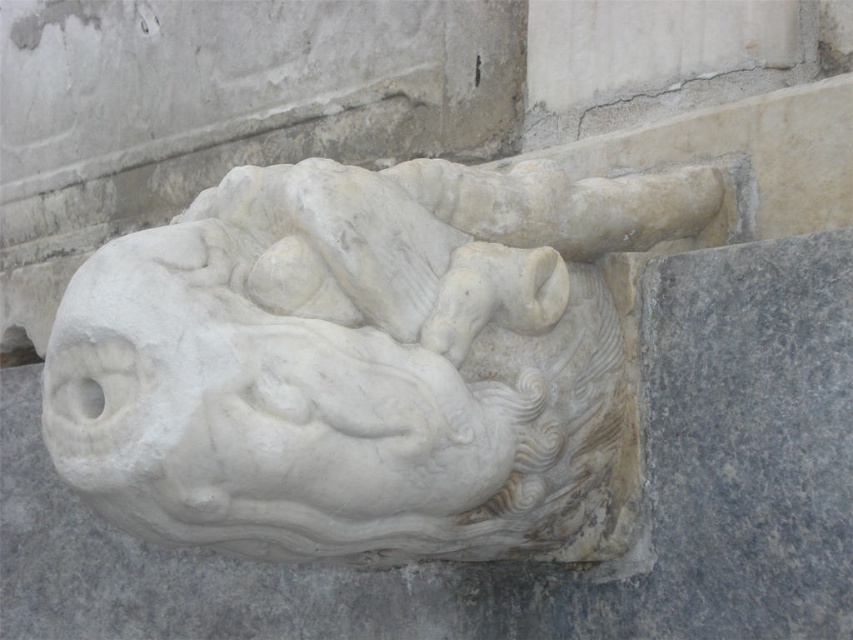
You are an art curator planning to install a motion sensor in front of the sculpture. The sensor needs to be placed at coordinates point 0.566, 0.429. Where should you position the sensor relative to the white marble horse at center?

The sensor should be positioned directly at the location of the white marble horse at center since the coordinates point (364,362) correspond to its exact position.

You are an art conservator examining the marble sculpture. You notice a crack at point (364,362). Which part of the sculpture is most likely affected by the crack?

The white marble horse at center is located at point (364,362), so the crack is most likely affecting the white marble horse at center.